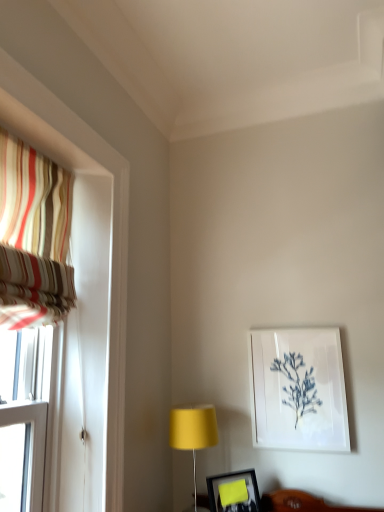
Question: Considering the relative sizes of matte black picture frame at lower center, the 1th picture frame from the left, and white paper at upper right, which is counted as the second picture frame, starting from the front, in the image provided, is matte black picture frame at lower center, the 1th picture frame from the left, thinner than white paper at upper right, which is counted as the second picture frame, starting from the front,?

Choices:
 (A) no
 (B) yes

Answer: (A)

Question: Is matte black picture frame at lower center, which is the 2th picture frame in top-to-bottom order, positioned before white paper at upper right, which ranks as the second picture frame in left-to-right order?

Choices:
 (A) no
 (B) yes

Answer: (B)

Question: From a real-world perspective, does matte black picture frame at lower center, the 1th picture frame from the left, stand above white paper at upper right, which ranks as the second picture frame in left-to-right order?

Choices:
 (A) no
 (B) yes

Answer: (A)

Question: Could you tell me if matte black picture frame at lower center, which appears as the 2th picture frame when viewed from the right, is facing white paper at upper right, the second picture frame in the bottom-to-top sequence?

Choices:
 (A) no
 (B) yes

Answer: (A)

Question: From a real-world perspective, is matte black picture frame at lower center, the first picture frame positioned from the front, positioned under white paper at upper right, acting as the 1th picture frame starting from the right, based on gravity?

Choices:
 (A) yes
 (B) no

Answer: (A)

Question: From their relative heights in the image, would you say matte yellow lampshade at center is taller or shorter than striped fabric curtain at left?

Choices:
 (A) tall
 (B) short

Answer: (B)

Question: From the image's perspective, relative to striped fabric curtain at left, is matte yellow lampshade at center above or below?

Choices:
 (A) above
 (B) below

Answer: (B)

Question: Is matte yellow lampshade at center wider or thinner than striped fabric curtain at left?

Choices:
 (A) wide
 (B) thin

Answer: (A)

Question: Visually, is matte yellow lampshade at center positioned to the left or to the right of striped fabric curtain at left?

Choices:
 (A) right
 (B) left

Answer: (A)

Question: From a real-world perspective, is striped fabric curtain at left positioned above or below matte yellow lampshade at center?

Choices:
 (A) below
 (B) above

Answer: (B)

Question: In the image, is striped fabric curtain at left positioned in front of or behind matte yellow lampshade at center?

Choices:
 (A) front
 (B) behind

Answer: (A)

Question: Would you say striped fabric curtain at left is inside or outside matte yellow lampshade at center?

Choices:
 (A) outside
 (B) inside

Answer: (A)

Question: Based on their positions, is striped fabric curtain at left located to the left or right of matte yellow lampshade at center?

Choices:
 (A) right
 (B) left

Answer: (B)

Question: In terms of height, does striped fabric curtain at left look taller or shorter compared to matte black picture frame at lower center, which appears as the 2th picture frame when viewed from the right?

Choices:
 (A) short
 (B) tall

Answer: (B)

Question: Is striped fabric curtain at left inside or outside of matte black picture frame at lower center, which appears as the 2th picture frame when viewed from the right?

Choices:
 (A) outside
 (B) inside

Answer: (A)